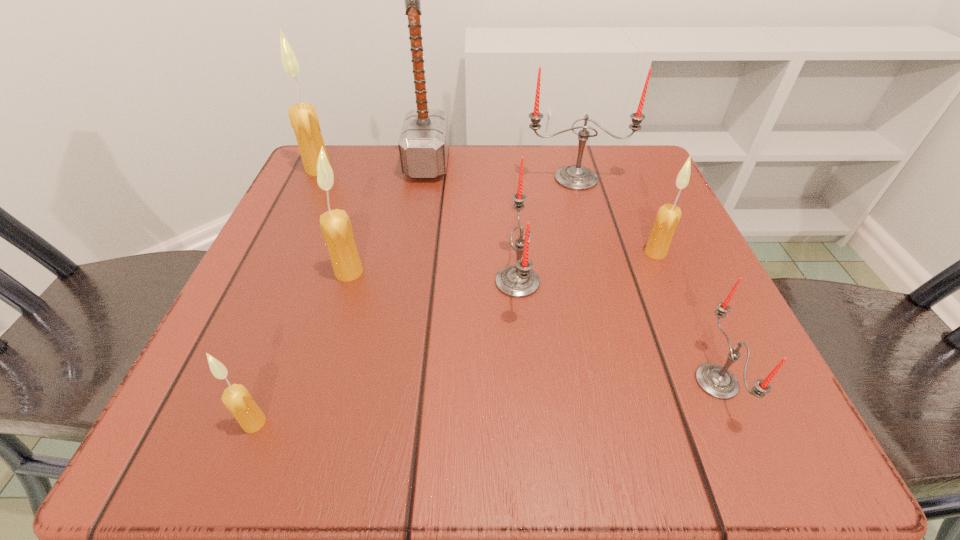
Where is `the second candle from left to right`? the second candle from left to right is located at coordinates (236, 398).

The width and height of the screenshot is (960, 540). What are the coordinates of `the smallest cream candle` in the screenshot? It's located at (236, 398).

You are a GUI agent. You are given a task and a screenshot of the screen. Output one action in this format:
    pyautogui.click(x=<x>, y=<y>)
    Task: Click on the nearest red candle
    Image resolution: width=960 pixels, height=540 pixels.
    Given the screenshot: What is the action you would take?
    pyautogui.click(x=715, y=380)

Identify the location of free spot located on the striking surface of the fourth object from left to right. coord(601,163).

You are a GUI agent. You are given a task and a screenshot of the screen. Output one action in this format:
    pyautogui.click(x=<x>, y=<y>)
    Task: Click on the free region located on the right of the second tallest object
    This screenshot has height=540, width=960.
    Given the screenshot: What is the action you would take?
    pyautogui.click(x=359, y=170)

Find the location of a particular element. free space located 0.200m on the front-facing side of the farthest red candle is located at coordinates (598, 259).

Where is `vacant space located on the front of the second biggest cream candle`? vacant space located on the front of the second biggest cream candle is located at coordinates (310, 402).

Image resolution: width=960 pixels, height=540 pixels. In order to click on free region located 0.250m on the front-facing side of the second nearest red candle in this screenshot , I will do `click(337, 282)`.

You are a GUI agent. You are given a task and a screenshot of the screen. Output one action in this format:
    pyautogui.click(x=<x>, y=<y>)
    Task: Click on the blank space located 0.380m on the front-facing side of the second nearest red candle
    The width and height of the screenshot is (960, 540).
    Given the screenshot: What is the action you would take?
    pyautogui.click(x=255, y=282)

Identify the location of vacant space situated 0.380m on the front-facing side of the second nearest red candle. This screenshot has width=960, height=540. click(x=255, y=282).